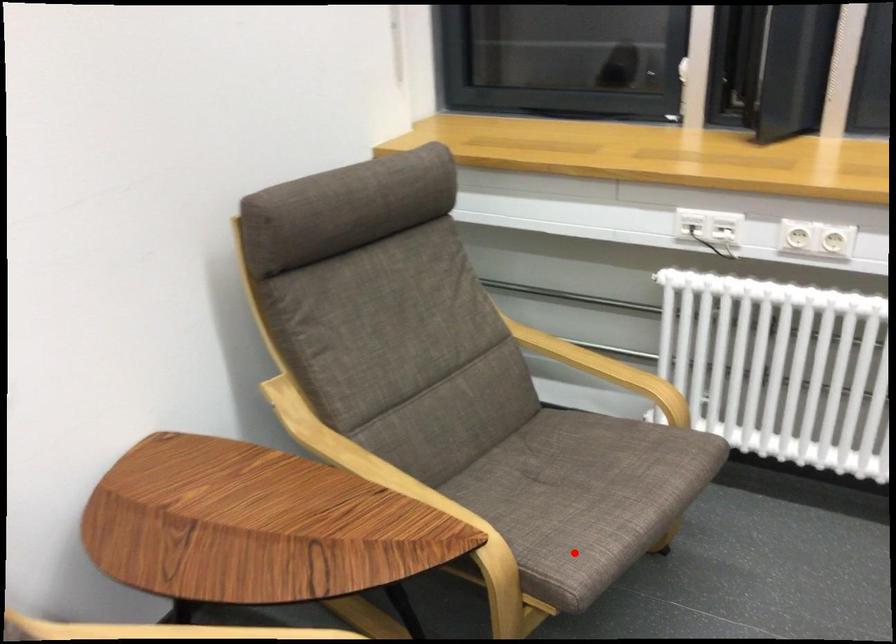
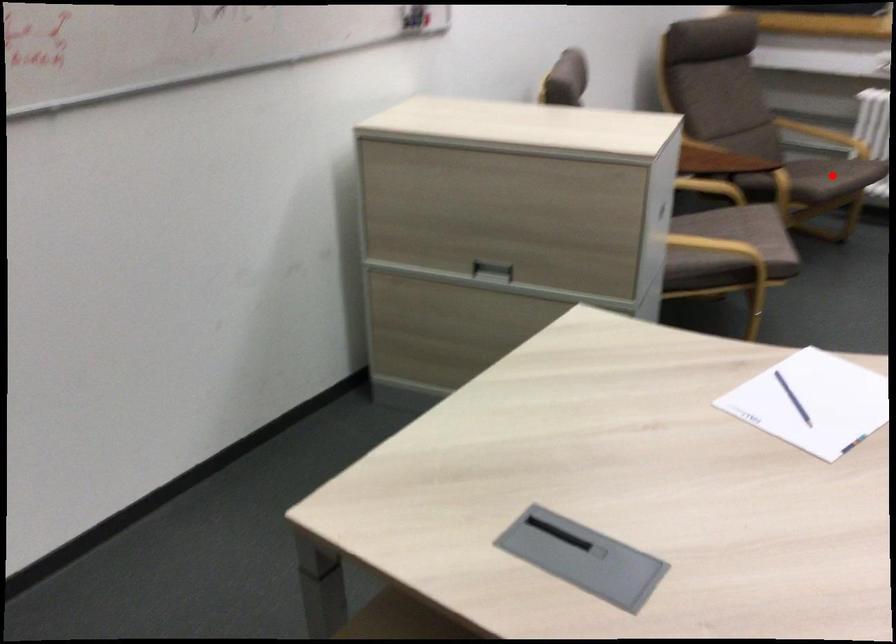
I am providing you with two images of the same scene from different viewpoints. A red point is marked on the first image and another point is marked on the second image. Is the red point in image1 aligned with the point shown in image2?

Yes